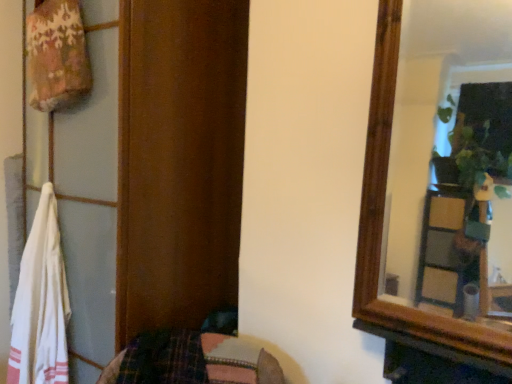
The image size is (512, 384). What do you see at coordinates (41, 303) in the screenshot?
I see `white cotton towel at left` at bounding box center [41, 303].

I want to click on white cotton towel at left, so click(x=41, y=303).

Describe the element at coordinates (150, 171) in the screenshot. I see `wooden dresser at left` at that location.

Identify the location of wooden dresser at left. The width and height of the screenshot is (512, 384). (150, 171).

Identify the location of white cotton towel at left. (41, 303).

Is white cotton towel at left to the left of wooden dresser at left from the viewer's perspective?

Yes, white cotton towel at left is to the left of wooden dresser at left.

Between white cotton towel at left and wooden dresser at left, which one is positioned behind?

white cotton towel at left is behind.

Which point is more distant from viewer, (x=37, y=267) or (x=76, y=370)?

Point (x=76, y=370)

From the picture: From the image's perspective, is white cotton towel at left on wooden dresser at left?

No.

From a real-world perspective, is white cotton towel at left physically above wooden dresser at left?

No, from a real-world perspective, white cotton towel at left is not over wooden dresser at left

Considering the sizes of objects white cotton towel at left and wooden dresser at left in the image provided, who is wider, white cotton towel at left or wooden dresser at left?

With larger width is wooden dresser at left.

Can you confirm if white cotton towel at left is taller than wooden dresser at left?

No, white cotton towel at left is not taller than wooden dresser at left.

Between white cotton towel at left and wooden dresser at left, which one has larger size?

A: wooden dresser at left.

Is wooden dresser at left completely or partially inside white cotton towel at left?

No.

Is white cotton towel at left next to wooden dresser at left and touching it?

They are not placed beside each other.

Is white cotton towel at left facing away from wooden dresser at left?

Yes, white cotton towel at left's orientation is away from wooden dresser at left.

How far apart are white cotton towel at left and wooden dresser at left?

32.52 centimeters.

Where is `beach towel behind the wooden dresser at left`? The height and width of the screenshot is (384, 512). beach towel behind the wooden dresser at left is located at coordinates (41, 303).

Between wooden dresser at left and white cotton towel at left, which one appears on the right side from the viewer's perspective?

From the viewer's perspective, wooden dresser at left appears more on the right side.

Looking at this image, is wooden dresser at left further to camera compared to white cotton towel at left?

No, wooden dresser at left is closer to the camera.

Between point (167, 49) and point (48, 235), which one is positioned in front?

Positioned in front is point (167, 49).

From the image's perspective, is wooden dresser at left located above or below white cotton towel at left?

Based on their image positions, wooden dresser at left is located above white cotton towel at left.

From a real-world perspective, is wooden dresser at left under white cotton towel at left?

No, from a real-world perspective, wooden dresser at left is not under white cotton towel at left.

Which object is wider, wooden dresser at left or white cotton towel at left?

wooden dresser at left is wider.

Which of these two, wooden dresser at left or white cotton towel at left, stands shorter?

white cotton towel at left is shorter.

Considering the relative sizes of wooden dresser at left and white cotton towel at left in the image provided, is wooden dresser at left bigger than white cotton towel at left?

Yes.

Is wooden dresser at left inside or outside of white cotton towel at left?

wooden dresser at left lies outside white cotton towel at left.

Are wooden dresser at left and white cotton towel at left far apart?

No, wooden dresser at left is not far from white cotton towel at left.

Could you tell me if wooden dresser at left is facing white cotton towel at left?

Yes, wooden dresser at left is facing white cotton towel at left.

In the image, there is a wooden dresser at left. Identify the location of beach towel below it (from the image's perspective). (41, 303).

In the image, there is a white cotton towel at left. At what (x,y) coordinates should I click in order to perform the action: click on dresser above it (from the image's perspective). Please return your answer as a coordinate pair (x, y). The width and height of the screenshot is (512, 384). Looking at the image, I should click on (150, 171).

Locate an element on the screen. This screenshot has height=384, width=512. beach towel located behind the wooden dresser at left is located at coordinates (41, 303).